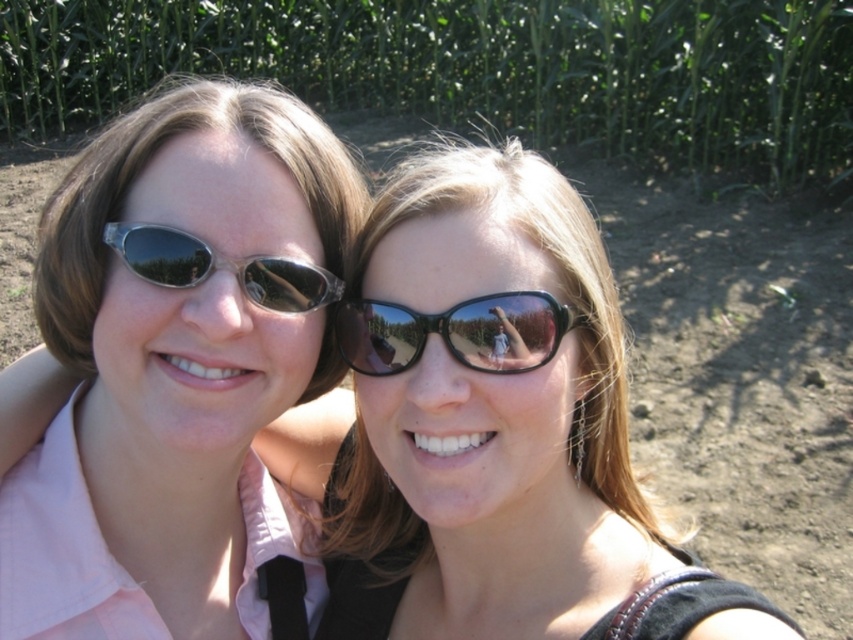
Between matte pink shirt at left and black glossy sunglasses at center, which one has more height?

Standing taller between the two is matte pink shirt at left.

Based on the photo, is matte pink shirt at left thinner than black glossy sunglasses at center?

No, matte pink shirt at left is not thinner than black glossy sunglasses at center.

Describe the element at coordinates (190, 323) in the screenshot. I see `matte pink shirt at left` at that location.

Identify the location of matte pink shirt at left. (190, 323).

Which is in front, point (397, 67) or point (476, 310)?

Point (476, 310) is more forward.

Between point (688, 33) and point (427, 330), which one is positioned behind?

The point (688, 33) is behind.

Is point (691, 17) positioned after point (473, 356)?

That is True.

Where is `green leafy corn at upper center`? The image size is (853, 640). green leafy corn at upper center is located at coordinates (474, 68).

Is green leafy corn at upper center closer to the viewer compared to matte black sunglasses at left?

No, it is not.

Can you confirm if green leafy corn at upper center is positioned above matte black sunglasses at left?

Correct, green leafy corn at upper center is located above matte black sunglasses at left.

Between point (44, 10) and point (316, 289), which one is positioned behind?

Positioned behind is point (44, 10).

The height and width of the screenshot is (640, 853). In order to click on green leafy corn at upper center in this screenshot , I will do `click(474, 68)`.